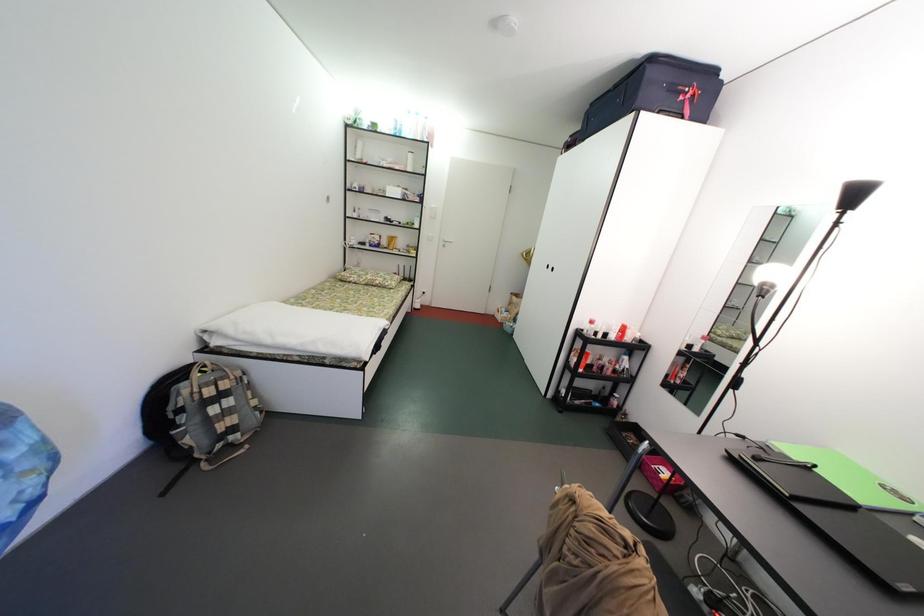
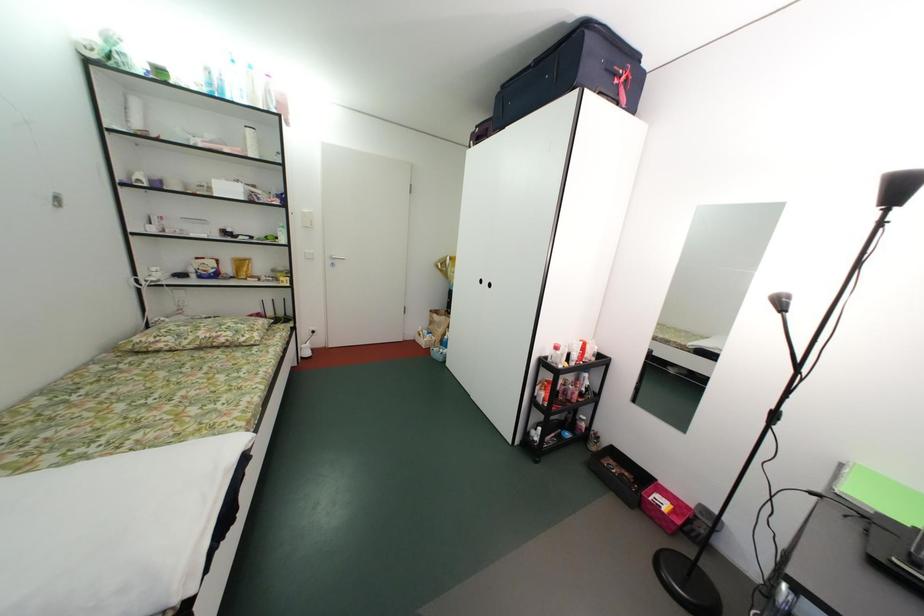
Question: The images are taken continuously from a first-person perspective. In which direction are you moving?

Choices:
 (A) Left
 (B) Right
 (C) Forward
 (D) Backward

Answer: (C)